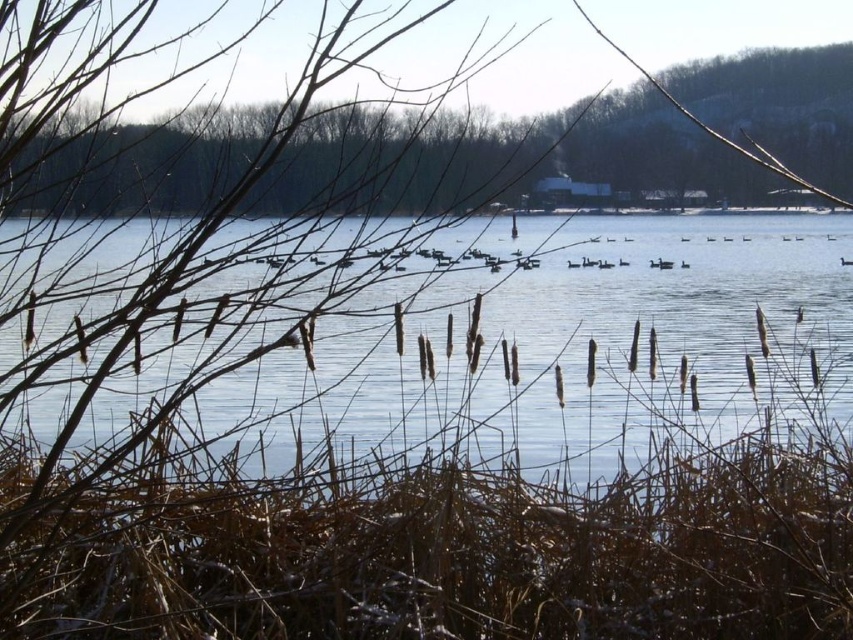
Question: Which of the following is the farthest from the observer?

Choices:
 (A) brown reeds at center
 (B) brown textured cattails at center

Answer: (A)

Question: Among these points, which one is farthest from the camera?

Choices:
 (A) (354, 321)
 (B) (642, 99)

Answer: (B)

Question: Does brown reeds at center appear under brown textured cattails at center?

Choices:
 (A) no
 (B) yes

Answer: (B)

Question: Among these objects, which one is nearest to the camera?

Choices:
 (A) brown reeds at center
 (B) brown textured cattails at center

Answer: (B)

Question: Does brown reeds at center appear over brown textured cattails at center?

Choices:
 (A) no
 (B) yes

Answer: (A)

Question: Can you confirm if brown reeds at center is positioned below brown textured cattails at center?

Choices:
 (A) yes
 (B) no

Answer: (A)